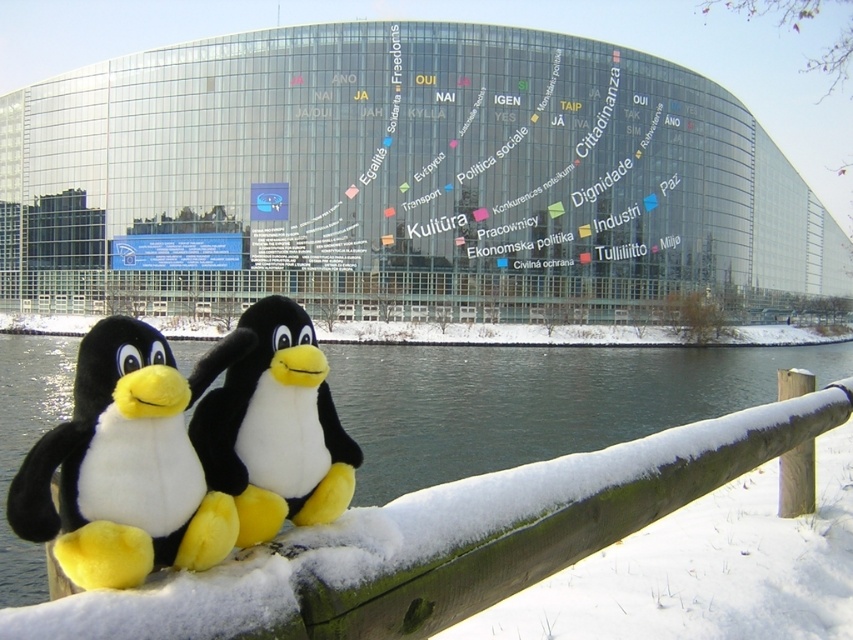
Question: Does white snow-covered water at lower center appear on the left side of black plush penguin at lower center?

Choices:
 (A) no
 (B) yes

Answer: (B)

Question: Which object appears closest to the camera in this image?

Choices:
 (A) black plush penguin at lower left
 (B) white snow-covered water at lower center
 (C) black plush penguin at lower center

Answer: (A)

Question: Estimate the real-world distances between objects in this image. Which object is farther from the black plush penguin at lower left?

Choices:
 (A) black plush penguin at lower center
 (B) white snow-covered water at lower center

Answer: (B)

Question: Where is white snow-covered water at lower center located in relation to black plush penguin at lower center in the image?

Choices:
 (A) right
 (B) left

Answer: (B)

Question: Which point is closer to the camera?

Choices:
 (A) (241, 422)
 (B) (38, 513)

Answer: (B)

Question: Is white snow-covered water at lower center positioned before black plush penguin at lower center?

Choices:
 (A) no
 (B) yes

Answer: (A)